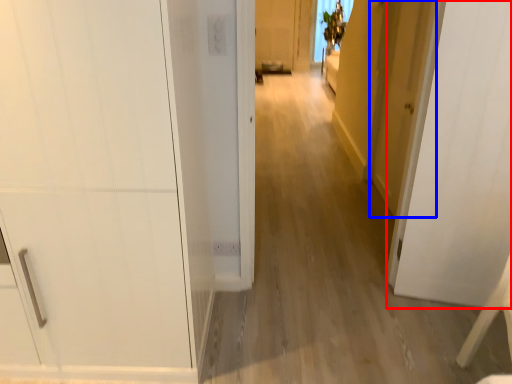
Question: Which of the following is the closest to the observer, door (highlighted by a red box) or door (highlighted by a blue box)?

Choices:
 (A) door
 (B) door

Answer: (A)